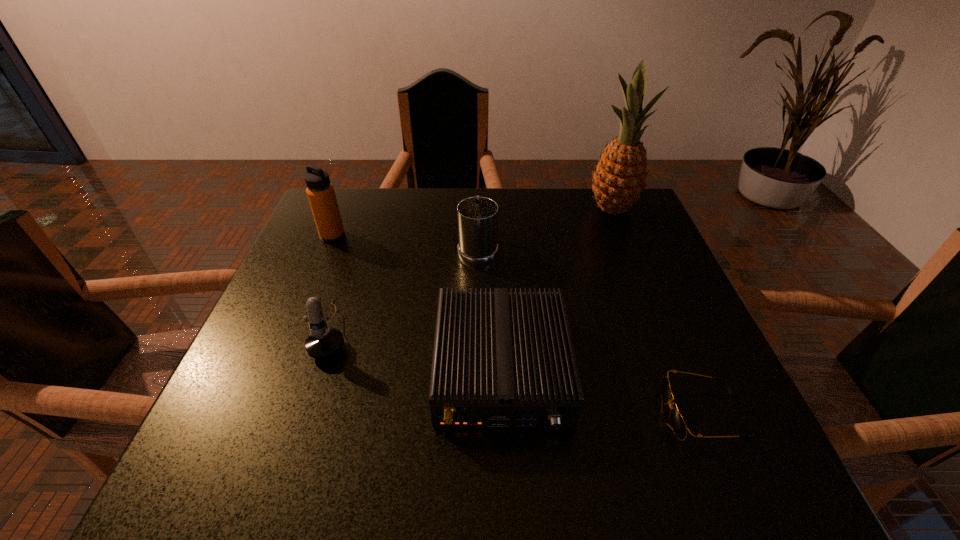
Find the location of `vacant space situated 0.050m on the side of the mug with the handle`. vacant space situated 0.050m on the side of the mug with the handle is located at coordinates (478, 221).

Where is `free space located on the side of the mug with the handle`? The image size is (960, 540). free space located on the side of the mug with the handle is located at coordinates (478, 189).

I want to click on free space located 0.070m on the side of the mug with the handle, so click(x=478, y=217).

Locate an element on the screen. The height and width of the screenshot is (540, 960). vacant space located 0.050m on the right of the microphone is located at coordinates (375, 330).

Find the location of `free space located 0.190m on the front-facing side of the shortest object`. free space located 0.190m on the front-facing side of the shortest object is located at coordinates (556, 414).

Locate an element on the screen. vacant space located 0.090m on the front-facing side of the shortest object is located at coordinates click(613, 414).

At what (x,y) coordinates should I click in order to perform the action: click on free space located on the front-facing side of the shortest object. Please return your answer as a coordinate pair (x, y). This screenshot has height=540, width=960. Looking at the image, I should click on (550, 414).

Find the location of a particular element. This screenshot has height=540, width=960. pineapple situated at the far edge is located at coordinates (619, 179).

The height and width of the screenshot is (540, 960). In order to click on thermos bottle that is at the far edge in this screenshot , I will do `click(320, 192)`.

Image resolution: width=960 pixels, height=540 pixels. I want to click on mug that is positioned at the far edge, so click(477, 216).